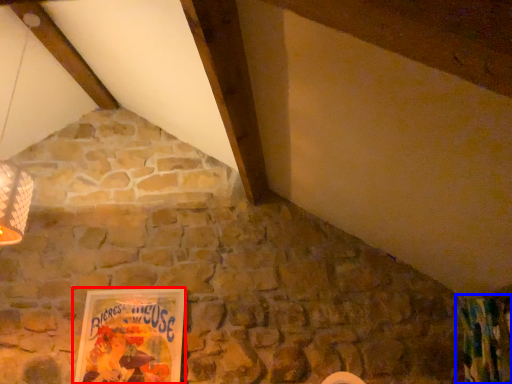
Question: Which object appears farthest to the camera in this image, picture frame (highlighted by a red box) or curtain (highlighted by a blue box)?

Choices:
 (A) picture frame
 (B) curtain

Answer: (A)